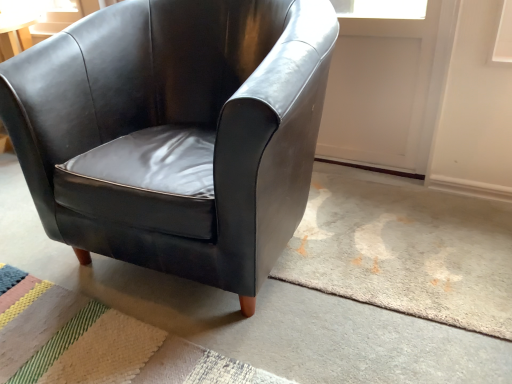
This screenshot has width=512, height=384. What do you see at coordinates (175, 132) in the screenshot?
I see `matte black armchair at center` at bounding box center [175, 132].

Identify the location of textured beige rug at lower left. (98, 343).

Is matte black armchair at center facing towards textured beige rug at lower left?

Yes.

Is matte black armchair at center far away from textured beige rug at lower left?

They are positioned close to each other.

Considering the sizes of matte black armchair at center and textured beige rug at lower left in the image, is matte black armchair at center taller or shorter than textured beige rug at lower left?

Considering their sizes, matte black armchair at center has more height than textured beige rug at lower left.

Which is behind, point (425, 380) or point (10, 276)?

The point (10, 276) is farther.

Is matte black armchair at center wider than textured beige rug at lower left?

In fact, matte black armchair at center might be narrower than textured beige rug at lower left.

This screenshot has height=384, width=512. In order to click on mat that appears below the matte black armchair at center (from a real-world perspective) in this screenshot , I will do `click(98, 343)`.

From a real-world perspective, is matte black armchair at center located higher than textured beige rug at lower left?

Yes, from a real-world perspective, matte black armchair at center is on top of textured beige rug at lower left.

Would you say matte black armchair at center is outside textured beige rug at lower left?

That's correct, matte black armchair at center is outside of textured beige rug at lower left.

In the image, is matte black armchair at center on the left side or the right side of matte black armchair at center?

From the image, it's evident that matte black armchair at center is to the right of matte black armchair at center.

Which of these two, matte black armchair at center or matte black armchair at center, is bigger?

With larger size is matte black armchair at center.

Is matte black armchair at center positioned beyond the bounds of matte black armchair at center?

That's correct, matte black armchair at center is outside of matte black armchair at center.

Which object is thinner, textured beige rug at lower left or matte black armchair at center?

With smaller width is matte black armchair at center.

Can you confirm if textured beige rug at lower left is smaller than matte black armchair at center?

Yes.

Is textured beige rug at lower left oriented away from matte black armchair at center?

No, textured beige rug at lower left is not facing away from matte black armchair at center.

From a real-world perspective, is textured beige rug at lower left physically above matte black armchair at center?

Actually, textured beige rug at lower left is physically below matte black armchair at center in the real world.

In terms of height, does textured beige rug at lower left look taller or shorter compared to matte black armchair at center?

Considering their sizes, textured beige rug at lower left has less height than matte black armchair at center.

Is textured beige rug at lower left situated inside matte black armchair at center or outside?

textured beige rug at lower left is contained in matte black armchair at center.

Locate an element on the screen. The height and width of the screenshot is (384, 512). mat lying below the matte black armchair at center (from the image's perspective) is located at coordinates (98, 343).

Considering the positions of points (362, 366) and (255, 219), is point (362, 366) farther from camera compared to point (255, 219)?

Yes, point (362, 366) is behind point (255, 219).

From the image's perspective, between matte black armchair at center and matte black armchair at center, who is located below?

matte black armchair at center appears lower in the image.

Is matte black armchair at center at the left side of matte black armchair at center?

Yes, matte black armchair at center is to the left of matte black armchair at center.

Looking at their sizes, would you say matte black armchair at center is wider or thinner than matte black armchair at center?

matte black armchair at center is wider than matte black armchair at center.

Locate an element on the screen. This screenshot has width=512, height=384. concrete below the textured beige rug at lower left (from a real-world perspective) is located at coordinates (258, 315).

Find the location of a particular element. This screenshot has width=512, height=384. chair that appears in front of the textured beige rug at lower left is located at coordinates (175, 132).

Considering their positions, is matte black armchair at center positioned further to matte black armchair at center than textured beige rug at lower left?

Based on the image, textured beige rug at lower left appears to be further to matte black armchair at center.

Which object lies further to the anchor point matte black armchair at center, matte black armchair at center or textured beige rug at lower left?

Among the two, matte black armchair at center is located further to matte black armchair at center.

Considering their positions, is textured beige rug at lower left positioned closer to matte black armchair at center than matte black armchair at center?

textured beige rug at lower left lies closer to matte black armchair at center than the other object.

From the image, which object appears to be farther from textured beige rug at lower left, matte black armchair at center or matte black armchair at center?

Among the two, matte black armchair at center is located further to textured beige rug at lower left.

Which object lies nearer to the anchor point matte black armchair at center, textured beige rug at lower left or matte black armchair at center?

matte black armchair at center is closer to matte black armchair at center.

Looking at the image, which one is located closer to textured beige rug at lower left, matte black armchair at center or matte black armchair at center?

Among the two, matte black armchair at center is located nearer to textured beige rug at lower left.

Identify the location of concrete that lies between matte black armchair at center and textured beige rug at lower left from top to bottom. The image size is (512, 384). (258, 315).